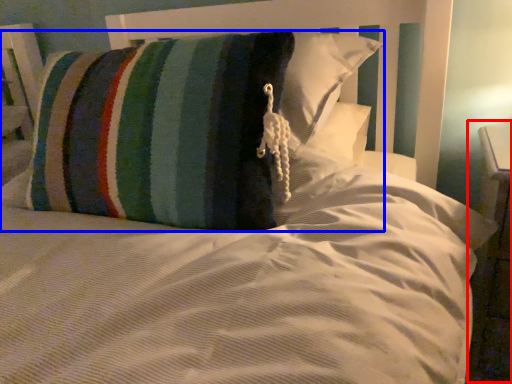
Question: Among these objects, which one is farthest to the camera, dresser (highlighted by a red box) or pillow (highlighted by a blue box)?

Choices:
 (A) dresser
 (B) pillow

Answer: (A)